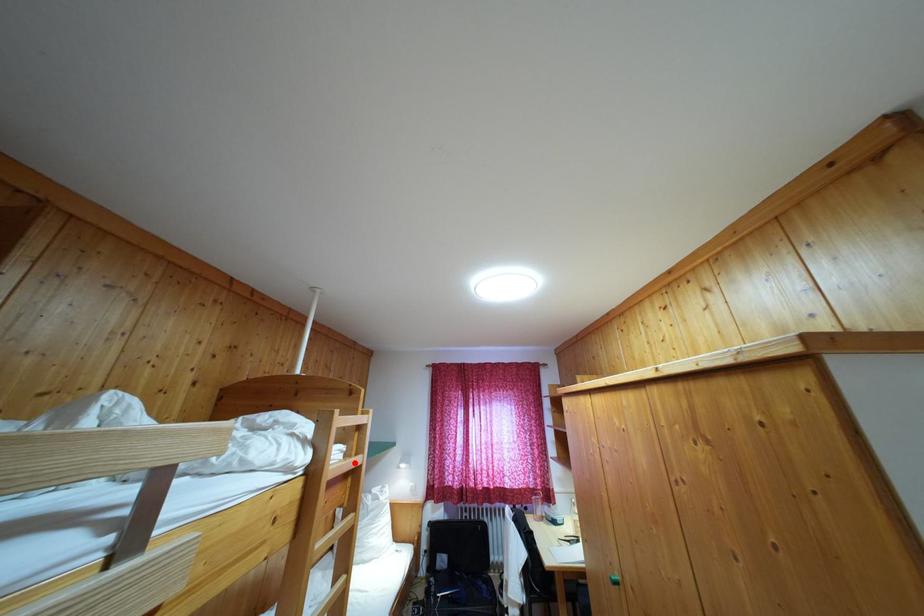
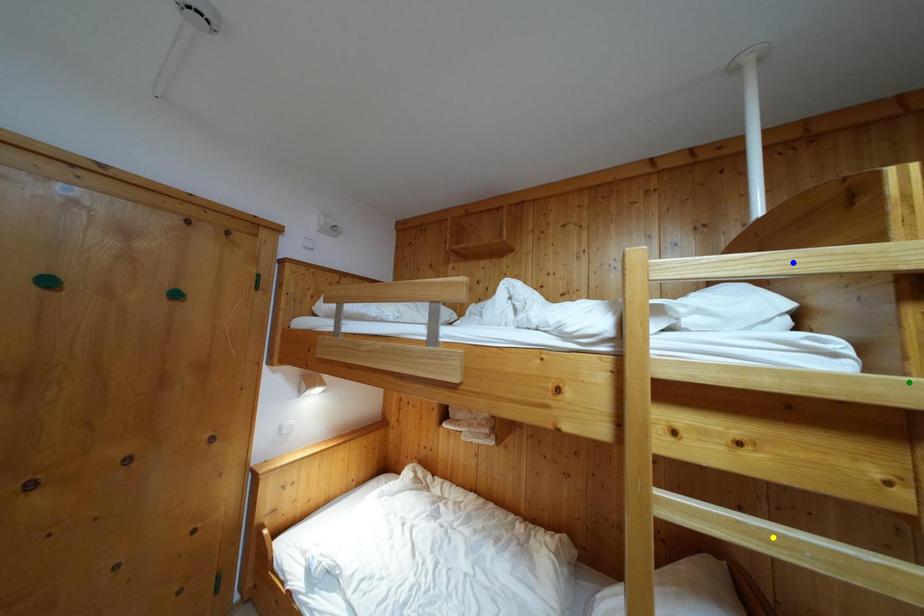
Question: I am providing you with two images of the same scene from different viewpoints. A red point is marked on the first image. You are given multiple points on the second image. Which point in image 2 is actually the same real-world point as the red point in image 1?

Choices:
 (A) blue point
 (B) green point
 (C) yellow point

Answer: (B)